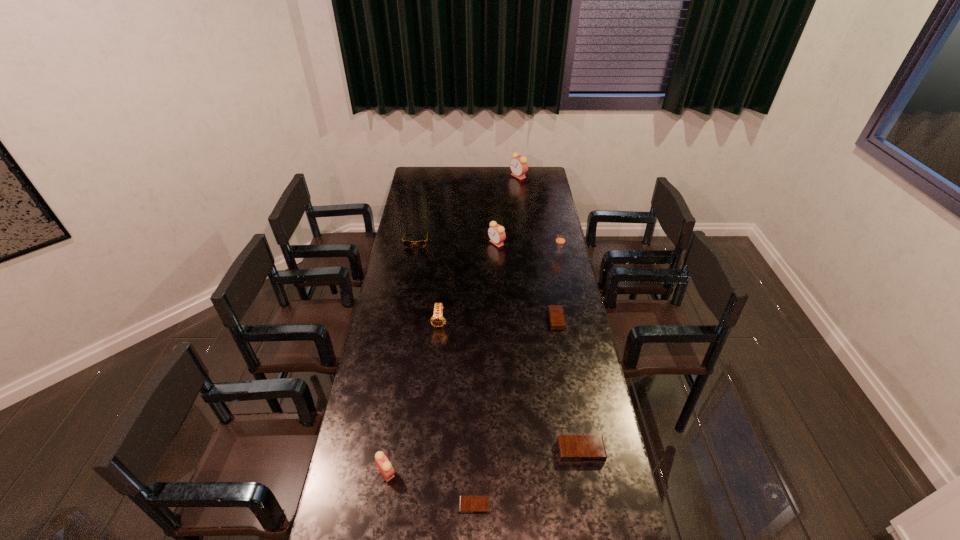
At what (x,y) coordinates should I click in order to perform the action: click on object that is the eighth closest to the leftmost alarm clock. Please return your answer as a coordinate pair (x, y). Looking at the image, I should click on (518, 165).

Identify which object is the sixth nearest to the second pink alarm clock from right to left. Please provide its 2D coordinates. Your answer should be formatted as a tuple, i.e. [(x, y)], where the tuple contains the x and y coordinates of a point satisfying the conditions above.

[(572, 448)]

At what (x,y) coordinates should I click in order to perform the action: click on the third closest alarm clock to the second nearest black alarm clock. Please return your answer as a coordinate pair (x, y). The height and width of the screenshot is (540, 960). Looking at the image, I should click on (384, 466).

Find the location of a particular element. alarm clock that stands as the closest to the second smallest pink alarm clock is located at coordinates (556, 316).

Point out which pink alarm clock is positioned as the second nearest to the black watch. Please provide its 2D coordinates. Your answer should be formatted as a tuple, i.e. [(x, y)], where the tuple contains the x and y coordinates of a point satisfying the conditions above.

[(384, 466)]

Where is `pink alarm clock that is the second closest to the smallest pink alarm clock`? The height and width of the screenshot is (540, 960). pink alarm clock that is the second closest to the smallest pink alarm clock is located at coordinates (518, 165).

Identify which black alarm clock is the closest to the black sunglasses. Please provide its 2D coordinates. Your answer should be formatted as a tuple, i.e. [(x, y)], where the tuple contains the x and y coordinates of a point satisfying the conditions above.

[(556, 316)]

This screenshot has height=540, width=960. I want to click on black alarm clock that is the closest to the black sunglasses, so click(556, 316).

The width and height of the screenshot is (960, 540). What are the coordinates of `free spot that satisfies the following two spatial constraints: 1. on the front face of the third shortest alarm clock; 2. on the face of the nearest pink alarm clock` in the screenshot? It's located at (585, 472).

Find the location of a particular element. free region that satisfies the following two spatial constraints: 1. on the face of the fifth nearest alarm clock; 2. on the face of the black watch is located at coordinates (500, 322).